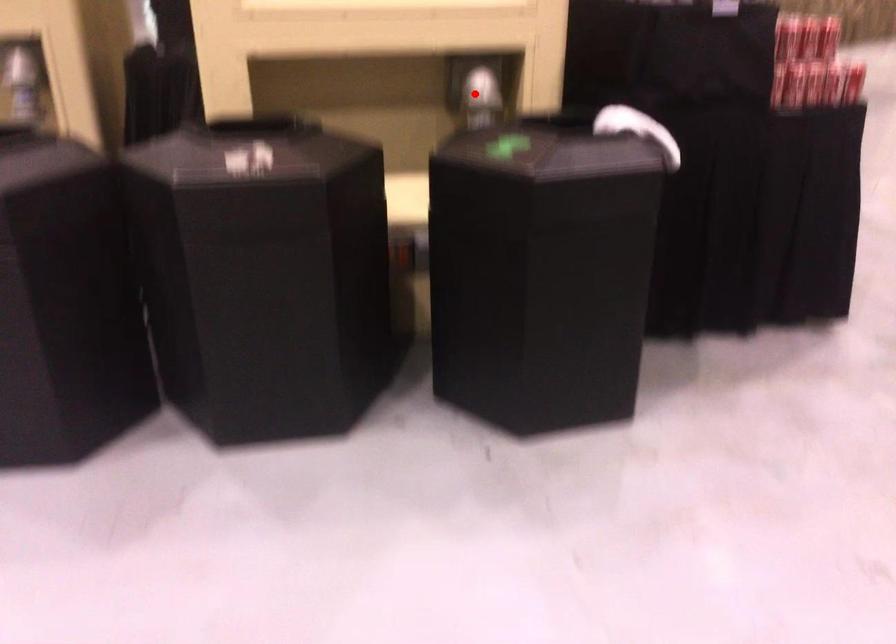
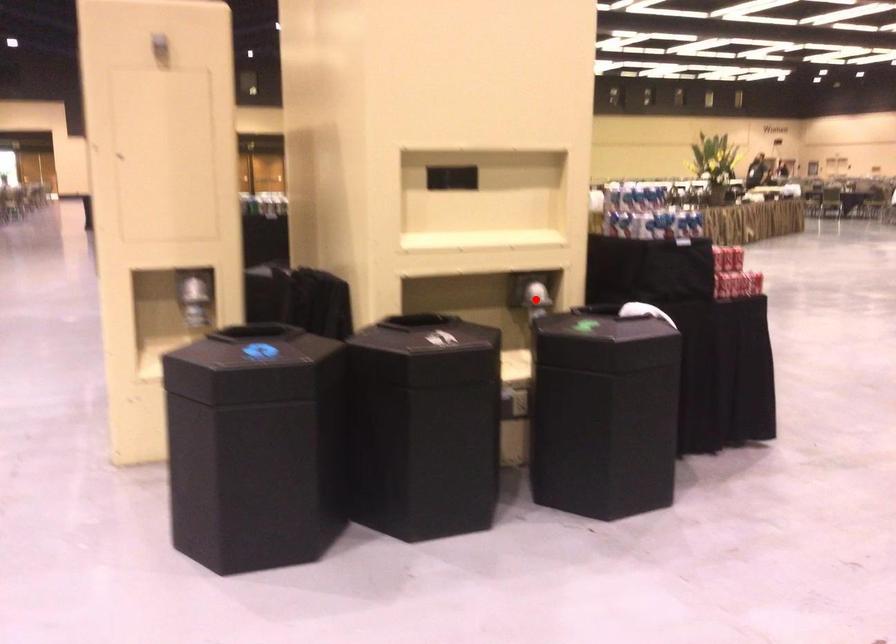
I am providing you with two images of the same scene from different viewpoints. A red point is marked on the first image and another point is marked on the second image. Is the red point in image1 aligned with the point shown in image2?

Yes